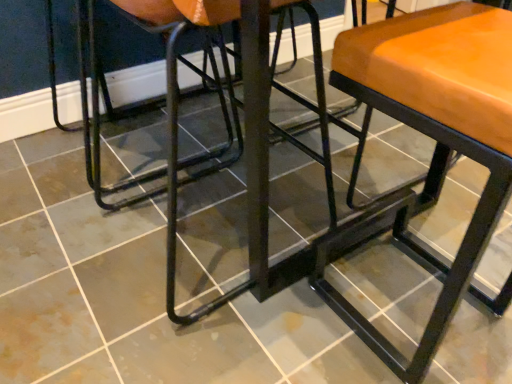
Question: Can you see matte orange cushioned stool at center touching black metal swivel chair at left?

Choices:
 (A) yes
 (B) no

Answer: (B)

Question: From the image's perspective, does matte orange cushioned stool at center appear lower than black metal swivel chair at left?

Choices:
 (A) yes
 (B) no

Answer: (A)

Question: From a real-world perspective, is matte orange cushioned stool at center located beneath black metal swivel chair at left?

Choices:
 (A) yes
 (B) no

Answer: (B)

Question: Does matte orange cushioned stool at center come behind black metal swivel chair at left?

Choices:
 (A) no
 (B) yes

Answer: (A)

Question: Considering the relative sizes of matte orange cushioned stool at center and black metal swivel chair at left in the image provided, is matte orange cushioned stool at center smaller than black metal swivel chair at left?

Choices:
 (A) no
 (B) yes

Answer: (B)

Question: Is matte orange cushioned stool at center positioned beyond the bounds of black metal swivel chair at left?

Choices:
 (A) no
 (B) yes

Answer: (B)

Question: Does black metal swivel chair at left lie behind matte orange cushioned stool at center?

Choices:
 (A) yes
 (B) no

Answer: (A)

Question: Does black metal swivel chair at left have a larger size compared to matte orange cushioned stool at center?

Choices:
 (A) no
 (B) yes

Answer: (B)

Question: Can you confirm if black metal swivel chair at left is positioned to the left of matte orange cushioned stool at center?

Choices:
 (A) no
 (B) yes

Answer: (B)

Question: Is black metal swivel chair at left smaller than matte orange cushioned stool at center?

Choices:
 (A) yes
 (B) no

Answer: (B)

Question: Can we say black metal swivel chair at left lies outside matte orange cushioned stool at center?

Choices:
 (A) yes
 (B) no

Answer: (A)

Question: Can you confirm if black metal swivel chair at left is shorter than matte orange cushioned stool at center?

Choices:
 (A) yes
 (B) no

Answer: (A)

Question: Choose the correct answer: Is matte orange cushioned stool at center inside black metal swivel chair at left or outside it?

Choices:
 (A) inside
 (B) outside

Answer: (B)